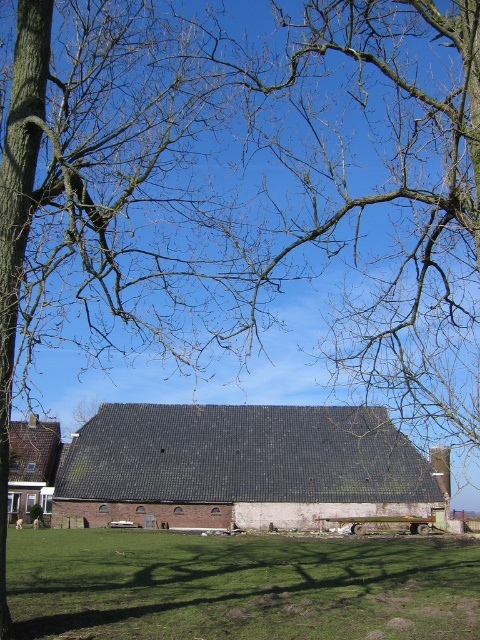
Between dark gray shingles at center and brown tiled barn at lower left, which one has more height?

brown tiled barn at lower left

Can you confirm if dark gray shingles at center is positioned to the right of brown tiled barn at lower left?

Correct, you'll find dark gray shingles at center to the right of brown tiled barn at lower left.

Which is behind, point (104, 412) or point (21, 445)?

Point (104, 412)

Locate an element on the screen. Image resolution: width=480 pixels, height=640 pixels. dark gray shingles at center is located at coordinates (240, 467).

Between green grass at lower center and brown tiled barn at lower left, which one is positioned higher?

green grass at lower center

Is point (137, 616) positioned before point (36, 476)?

Yes, it is.

I want to click on green grass at lower center, so click(x=240, y=586).

Who is more distant from viewer, (155, 596) or (240, 404)?

The point (240, 404) is behind.

Locate an element on the screen. The image size is (480, 640). green grass at lower center is located at coordinates (240, 586).

The width and height of the screenshot is (480, 640). What are the coordinates of `green grass at lower center` in the screenshot? It's located at (240, 586).

Where is `green grass at lower center`? The image size is (480, 640). green grass at lower center is located at coordinates (240, 586).